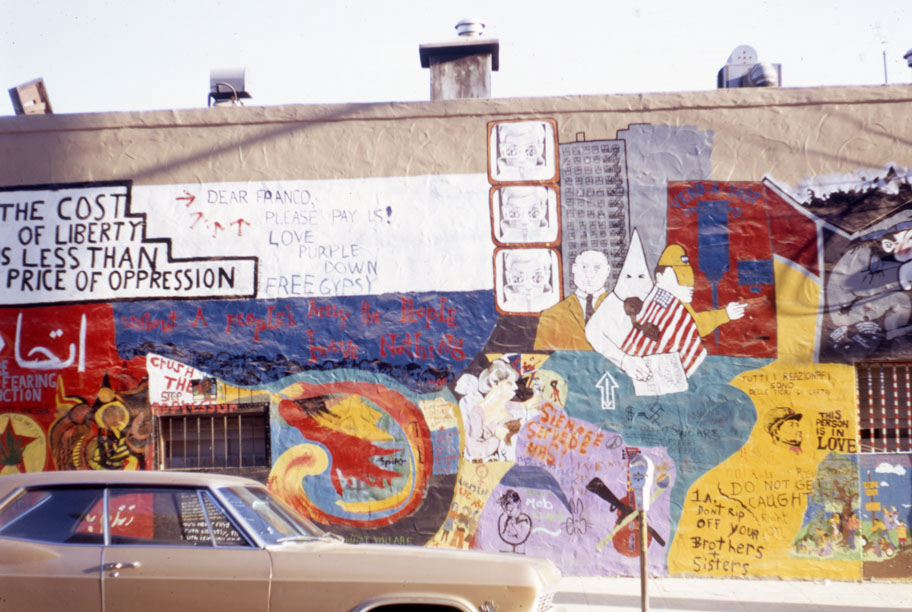
Locate an element on the screen. Image resolution: width=912 pixels, height=612 pixels. mural painted on wall is located at coordinates (394, 214), (654, 174), (744, 259), (774, 431), (401, 427), (277, 338), (67, 346), (63, 229).